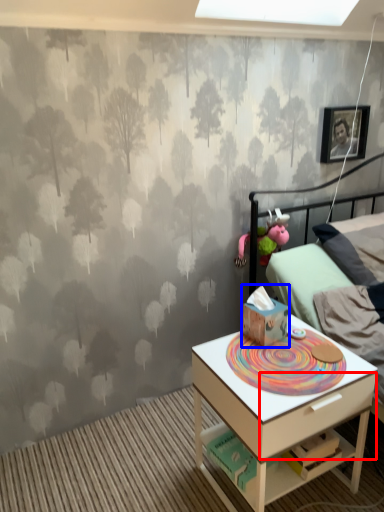
Question: Which object appears farthest to the camera in this image, drawer (highlighted by a red box) or toy (highlighted by a blue box)?

Choices:
 (A) drawer
 (B) toy

Answer: (B)